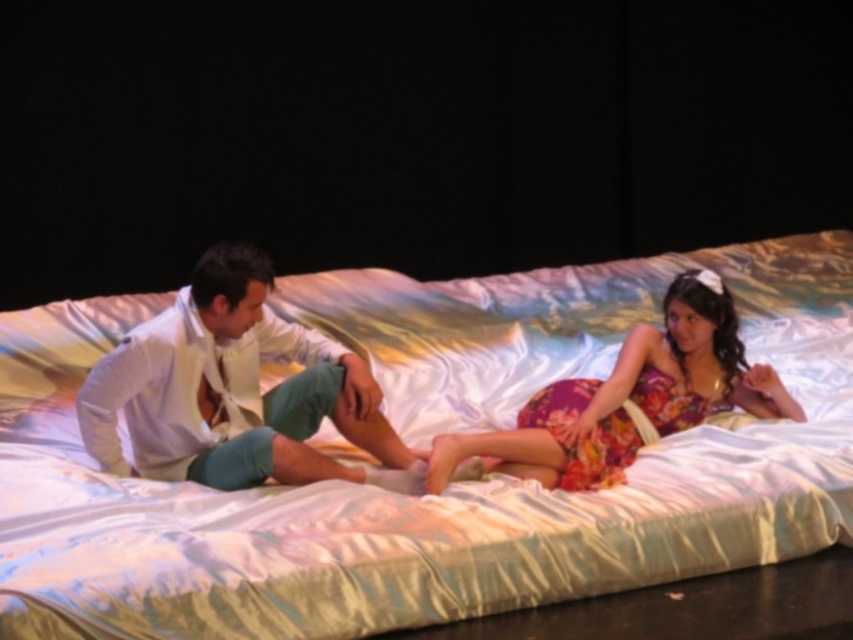
Question: Which point is farther to the camera?

Choices:
 (A) white satin shirt at center
 (B) silky satin bed at center

Answer: (B)

Question: Is silky satin bed at center to the left of white satin shirt at center from the viewer's perspective?

Choices:
 (A) no
 (B) yes

Answer: (A)

Question: Which is nearer to the floral fabric dress at center?

Choices:
 (A) silky satin bed at center
 (B) white satin shirt at center

Answer: (B)

Question: Is silky satin bed at center further to the viewer compared to white satin shirt at center?

Choices:
 (A) no
 (B) yes

Answer: (B)

Question: Does white satin shirt at center have a greater width compared to floral fabric dress at center?

Choices:
 (A) no
 (B) yes

Answer: (A)

Question: Which is farther from the silky satin bed at center?

Choices:
 (A) white satin shirt at center
 (B) floral fabric dress at center

Answer: (A)